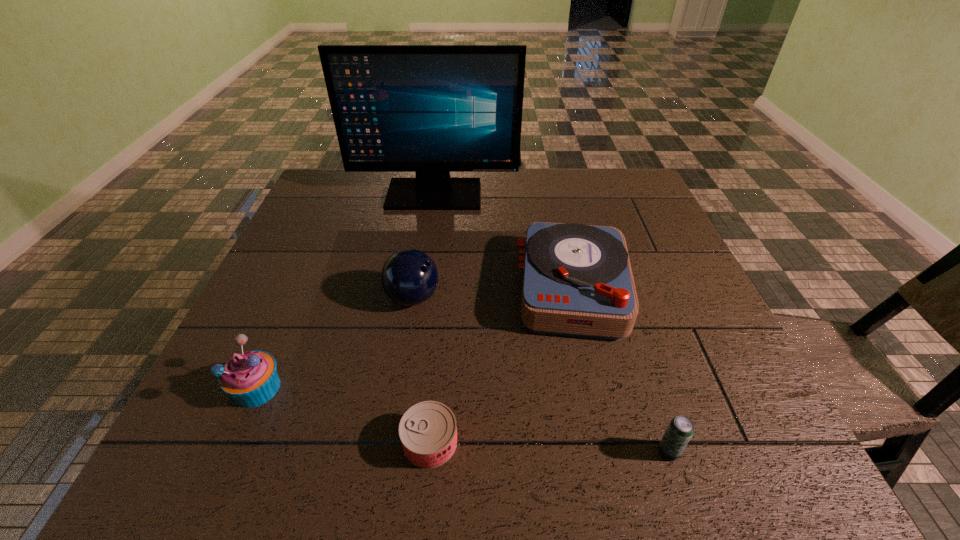
At what (x,y) coordinates should I click in order to perform the action: click on free location located on the right of the muffin. Please return your answer as a coordinate pair (x, y). Looking at the image, I should click on (361, 388).

Find the location of a particular element. blank space located on the left of the fifth tallest object is located at coordinates (477, 451).

In order to click on vacant space located on the right of the shortest object in this screenshot , I will do `click(618, 442)`.

Find the location of a particular element. The width and height of the screenshot is (960, 540). object situated at the far edge is located at coordinates (430, 109).

Where is `beer can that is at the near edge`? This screenshot has height=540, width=960. beer can that is at the near edge is located at coordinates (680, 430).

Where is `can that is at the near edge`? can that is at the near edge is located at coordinates [428, 430].

Locate an element on the screen. The width and height of the screenshot is (960, 540). monitor that is at the left edge is located at coordinates (430, 109).

The height and width of the screenshot is (540, 960). I want to click on muffin situated at the left edge, so click(250, 378).

At what (x,y) coordinates should I click in order to perform the action: click on object at the far left corner. Please return your answer as a coordinate pair (x, y). The width and height of the screenshot is (960, 540). Looking at the image, I should click on (430, 109).

The image size is (960, 540). Identify the location of vacant region at the far edge of the desktop. (487, 173).